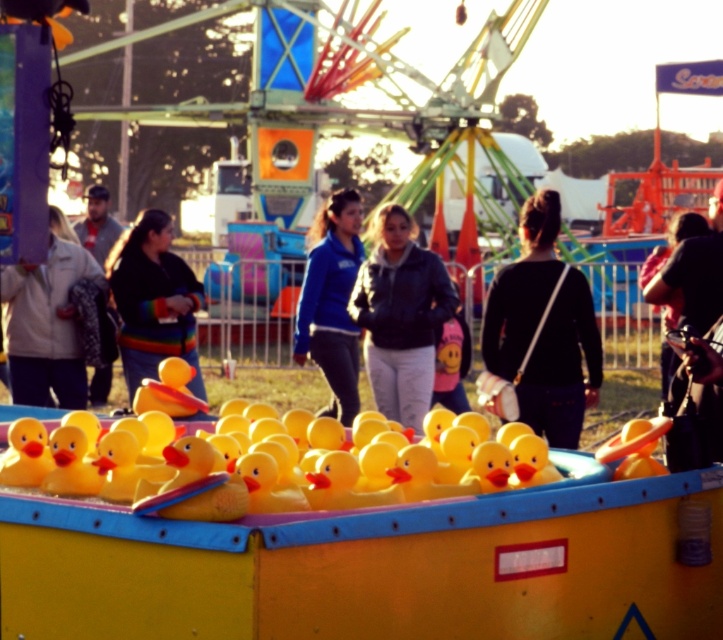
Question: Which point appears closest to the camera in this image?

Choices:
 (A) (103, 392)
 (B) (338, 224)
 (C) (115, 275)

Answer: (C)

Question: Estimate the real-world distances between objects in this image. Which object is farther from the dark blue jacket at center?

Choices:
 (A) rainbow striped sweater at center
 (B) light brown jacket at left
 (C) black matte jacket at center

Answer: (B)

Question: Does rubber duck at center have a lesser width compared to light beige jacket at left?

Choices:
 (A) yes
 (B) no

Answer: (B)

Question: Does rainbow striped sweater at center appear over light brown jacket at left?

Choices:
 (A) no
 (B) yes

Answer: (A)

Question: Is black matte jacket at center smaller than dark blue jacket at center?

Choices:
 (A) yes
 (B) no

Answer: (A)

Question: Based on their relative distances, which object is nearer to the rainbow striped sweater at center?

Choices:
 (A) blue fleece jacket at center
 (B) light beige jacket at left
 (C) rubber duck at center
 (D) dark blue jacket at center

Answer: (B)